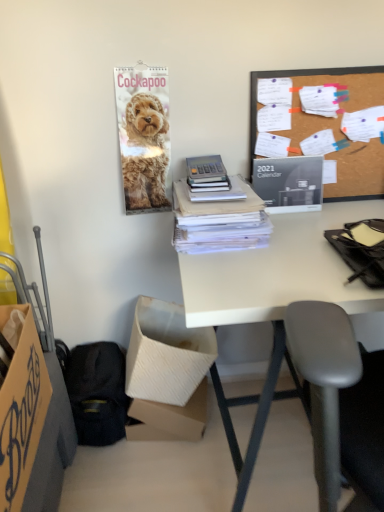
The image size is (384, 512). Describe the element at coordinates (95, 390) in the screenshot. I see `black fabric handbag at lower left` at that location.

The image size is (384, 512). What do you see at coordinates (166, 354) in the screenshot? I see `white cardboard box at lower left, which is counted as the 2th box, starting from the front` at bounding box center [166, 354].

What do you see at coordinates (216, 226) in the screenshot? I see `white paper at center` at bounding box center [216, 226].

In order to face white paper at center, should I rotate leftwards or rightwards?

Turn right by 3.446 degrees to look at white paper at center.

This screenshot has width=384, height=512. Describe the element at coordinates (289, 183) in the screenshot. I see `black glossy calendar at upper right` at that location.

Based on the photo, in order to face black glossy calendar at upper right, should I rotate leftwards or rightwards?

It's best to rotate right around 12.824 degrees.

What do you see at coordinates (284, 275) in the screenshot? I see `white matte desk at center` at bounding box center [284, 275].

Locate an element on the screen. The image size is (384, 512). black fabric handbag at lower left is located at coordinates (95, 390).

From the image's perspective, who appears lower, white paper at center or black fabric handbag at lower left?

From the image's view, black fabric handbag at lower left is below.

Consider the image. Is white paper at center next to black fabric handbag at lower left?

No, white paper at center is not touching black fabric handbag at lower left.

Is point (256, 246) closer or farther from the camera than point (69, 390)?

Point (256, 246) is positioned closer to the camera compared to point (69, 390).

Looking at this image, measure the distance between white paper at center and black fabric handbag at lower left.

white paper at center is 24.91 inches away from black fabric handbag at lower left.

How many degrees apart are the facing directions of white cardboard box at lower left, the 1th box from the back, and burlap-like fabric at upper right?

The facing directions of white cardboard box at lower left, the 1th box from the back, and burlap-like fabric at upper right are 4.79 degrees apart.

From the image's perspective, is white cardboard box at lower left, the 1th box from the back, located above or below burlap-like fabric at upper right?

Based on their image positions, white cardboard box at lower left, the 1th box from the back, is located beneath burlap-like fabric at upper right.

Can you confirm if white cardboard box at lower left, marked as the third box in a front-to-back arrangement, is thinner than burlap-like fabric at upper right?

No, white cardboard box at lower left, marked as the third box in a front-to-back arrangement, is not thinner than burlap-like fabric at upper right.

Is point (198, 394) in front of point (340, 118)?

No, (198, 394) is further to viewer.

How different are the orientations of burlap-like fabric at upper right and white paper at center in degrees?

The angular difference between burlap-like fabric at upper right and white paper at center is 0.118 degrees.

The height and width of the screenshot is (512, 384). Identify the location of whiteboard that appears on the right of white paper at center. (320, 84).

From the image's perspective, is burlap-like fabric at upper right on white paper at center?

Yes, from the image's perspective, burlap-like fabric at upper right is on top of white paper at center.

Is burlap-like fabric at upper right far away from white paper at center?

No, burlap-like fabric at upper right is in close proximity to white paper at center.

Is white cardboard box at lower left, the 1th box from the back, not close to black fabric handbag at lower left?

No.

Which point is more distant from viewer, (169, 429) or (85, 381)?

The point (169, 429) is behind.

From the image's perspective, is white cardboard box at lower left, the 1th box from the back, positioned above or below black fabric handbag at lower left?

white cardboard box at lower left, the 1th box from the back, is below black fabric handbag at lower left.

Is white cardboard box at lower left, the 1th box from the back, oriented away from black fabric handbag at lower left?

That's not correct — white cardboard box at lower left, the 1th box from the back, is not looking away from black fabric handbag at lower left.

The image size is (384, 512). I want to click on magazine below the burlap-like fabric at upper right (from the image's perspective), so click(x=289, y=183).

From the image's perspective, which is below, black glossy calendar at upper right or burlap-like fabric at upper right?

black glossy calendar at upper right is shown below in the image.

Does black glossy calendar at upper right have a lesser height compared to burlap-like fabric at upper right?

Yes.

Is black glossy calendar at upper right not close to burlap-like fabric at upper right?

That's not correct — black glossy calendar at upper right is a little close to burlap-like fabric at upper right.

Is point (132, 358) positioned in front of point (134, 425)?

Yes, it is in front of point (134, 425).

This screenshot has height=512, width=384. I want to click on box below the white cardboard box at lower left, which is counted as the 2th box, starting from the front (from the image's perspective), so click(x=169, y=418).

Between white cardboard box at lower left, the 2th box from the back, and white cardboard box at lower left, the 1th box from the back, which one appears on the left side from the viewer's perspective?

white cardboard box at lower left, the 1th box from the back.

Does white cardboard box at lower left, the 2th box from the back, have a lesser width compared to white cardboard box at lower left, marked as the third box in a front-to-back arrangement?

Incorrect, the width of white cardboard box at lower left, the 2th box from the back, is not less than that of white cardboard box at lower left, marked as the third box in a front-to-back arrangement.

Is point (188, 409) positioned behind point (177, 213)?

Yes, it is.

Considering the sizes of objects white cardboard box at lower left, the 1th box from the back, and white paper at center in the image provided, who is bigger, white cardboard box at lower left, the 1th box from the back, or white paper at center?

white cardboard box at lower left, the 1th box from the back.

From the image's perspective, which one is positioned higher, white cardboard box at lower left, the 1th box from the back, or white paper at center?

white paper at center appears higher in the image.

From the picture: Which object is positioned more to the right, white cardboard box at lower left, the 1th box from the back, or white paper at center?

white paper at center is more to the right.

Image resolution: width=384 pixels, height=512 pixels. Find the location of `office supplies above the black fabric handbag at lower left (from a real-world perspective)`. office supplies above the black fabric handbag at lower left (from a real-world perspective) is located at coordinates (216, 226).

From a real-world perspective, which box is the 3rd one underneath the burlap-like fabric at upper right? Please provide its 2D coordinates.

[(169, 418)]

From the image, which object appears to be nearer to white paper at center, golden fur calendar at upper left or white cardboard box at lower left, marked as the third box in a front-to-back arrangement?

golden fur calendar at upper left.

Considering their positions, is black glossy calendar at upper right positioned closer to white matte desk at center than golden fur calendar at upper left?

black glossy calendar at upper right lies closer to white matte desk at center than the other object.

When comparing their distances from white cardboard box at lower left, the 1th box from the back, does black fabric handbag at lower left or cardboard box at lower left, the 1th box from the front, seem further?

cardboard box at lower left, the 1th box from the front, is positioned further to the anchor white cardboard box at lower left, the 1th box from the back.

Looking at the image, which one is located further to black fabric handbag at lower left, black glossy calendar at upper right or white cardboard box at lower left, which is counted as the 2th box, starting from the front?

Among the two, black glossy calendar at upper right is located further to black fabric handbag at lower left.

Based on their spatial positions, is burlap-like fabric at upper right or golden fur calendar at upper left closer to black glossy calendar at upper right?

burlap-like fabric at upper right is positioned closer to the anchor black glossy calendar at upper right.

Based on their spatial positions, is white matte desk at center or white paper at center closer to white cardboard box at lower left, which is counted as the 2th box, starting from the front?

Among the two, white paper at center is located nearer to white cardboard box at lower left, which is counted as the 2th box, starting from the front.

Which object lies nearer to the anchor point white cardboard box at lower left, the 1th box from the back, white matte desk at center or golden fur calendar at upper left?

Among the two, white matte desk at center is located nearer to white cardboard box at lower left, the 1th box from the back.

Which object lies further to the anchor point black fabric handbag at lower left, black glossy calendar at upper right or white matte desk at center?

black glossy calendar at upper right lies further to black fabric handbag at lower left than the other object.

Locate an element on the screen. The image size is (384, 512). office supplies between white cardboard box at lower left, which is counted as the 2th box, starting from the front, and white matte desk at center is located at coordinates (216, 226).

The height and width of the screenshot is (512, 384). Identify the location of desk that lies between burlap-like fabric at upper right and black fabric handbag at lower left from top to bottom. point(284,275).

Identify the location of office supplies between cardboard box at lower left, the 1th box from the front, and black fabric handbag at lower left, along the z-axis. The height and width of the screenshot is (512, 384). (216, 226).

Where is `magazine between cardboard box at lower left, which appears as the third box when viewed from the back, and white matte desk at center from left to right`? This screenshot has width=384, height=512. magazine between cardboard box at lower left, which appears as the third box when viewed from the back, and white matte desk at center from left to right is located at coordinates (x=289, y=183).